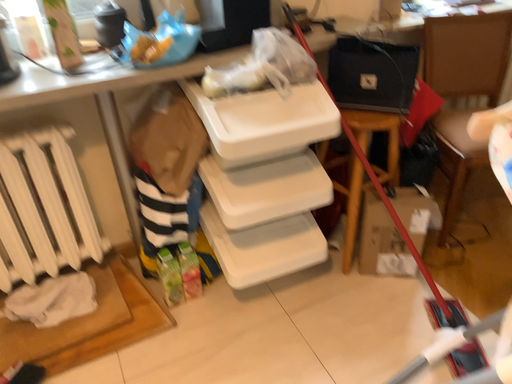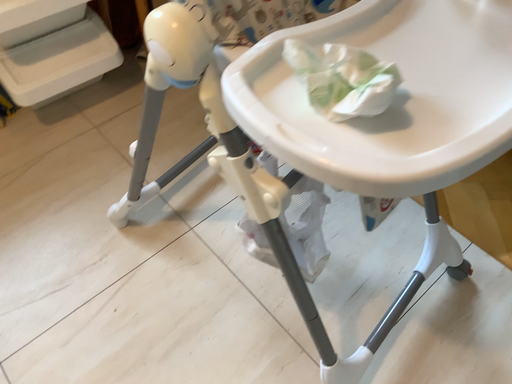
Question: How did the camera likely rotate when shooting the video?

Choices:
 (A) rotated downward
 (B) rotated upward

Answer: (A)